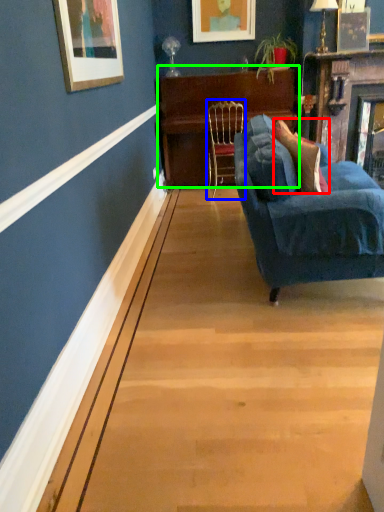
Question: Which is farther away from pillow (highlighted by a red box)? chair (highlighted by a blue box) or table (highlighted by a green box)?

Choices:
 (A) chair
 (B) table

Answer: (B)